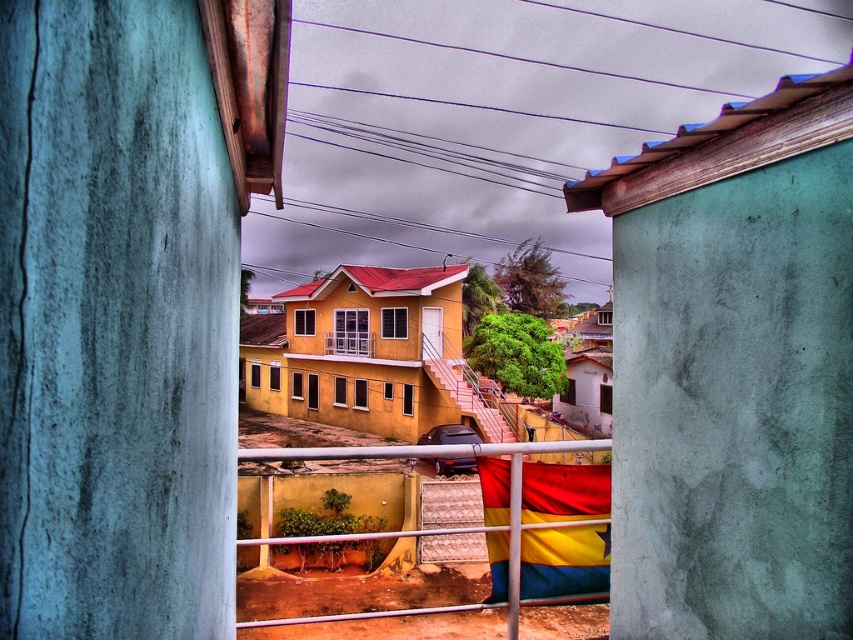
Does metallic silver fence at center have a lesser height compared to white painted wood balcony at center?

No, metallic silver fence at center is not shorter than white painted wood balcony at center.

Who is more forward, (451,445) or (358,346)?

Point (451,445) is more forward.

At what (x,y) coordinates should I click in order to perform the action: click on metallic silver fence at center. Please return your answer as a coordinate pair (x, y). The height and width of the screenshot is (640, 853). Looking at the image, I should click on (451, 456).

Identify the location of metallic silver fence at center. (451, 456).